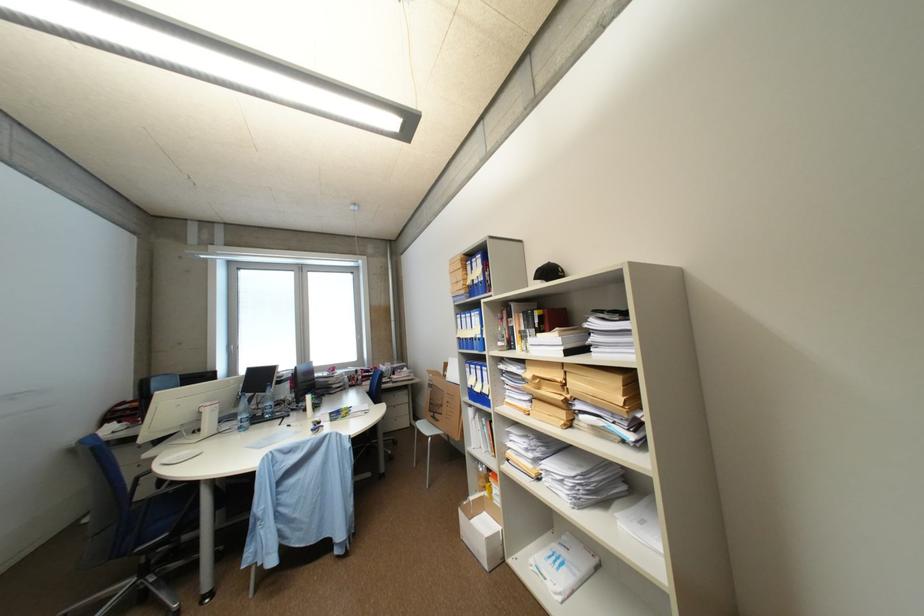
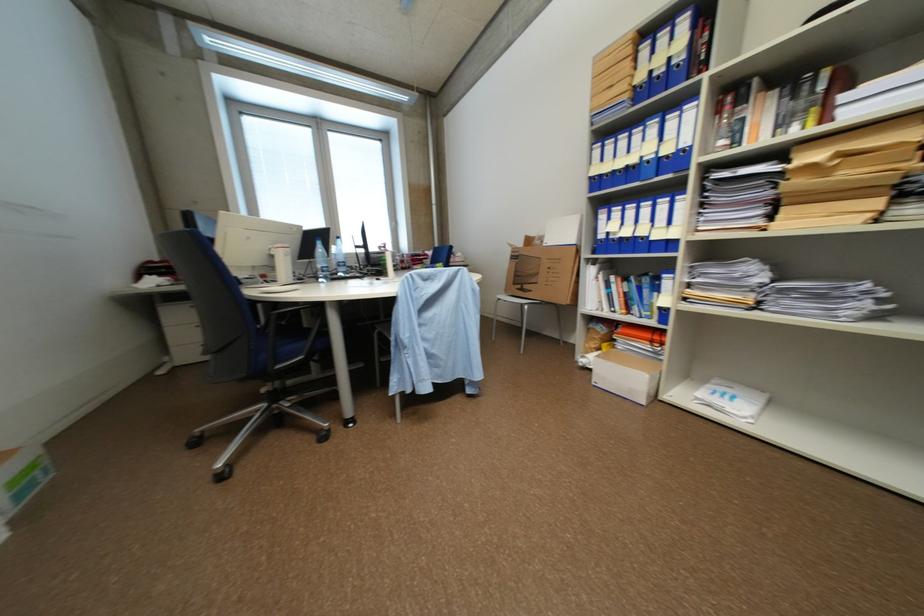
Find the pixel in the second image that matches (x=467, y=339) in the first image.

(600, 180)